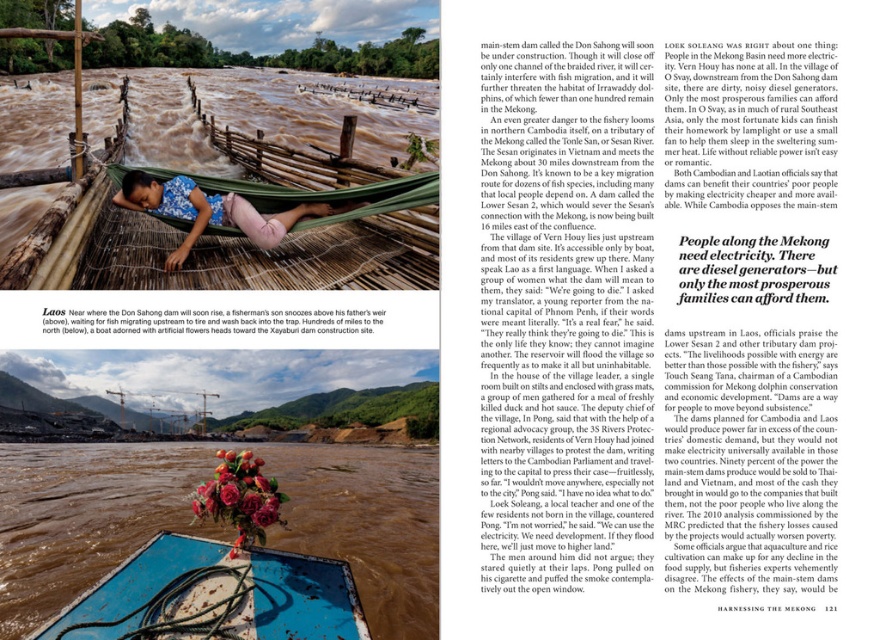
Question: Which of the following is the farthest from the observer?

Choices:
 (A) brown rubber boat at lower center
 (B) blue rubber boat at lower center

Answer: (A)

Question: Which of the following is the closest to the observer?

Choices:
 (A) floral fabric hammock at center
 (B) brown rubber boat at lower center
 (C) blue rubber boat at lower center

Answer: (C)

Question: Does brown rubber boat at lower center appear on the left side of blue rubber boat at lower center?

Choices:
 (A) yes
 (B) no

Answer: (A)

Question: Can you confirm if brown rubber boat at lower center is smaller than blue rubber boat at lower center?

Choices:
 (A) yes
 (B) no

Answer: (B)

Question: Can you confirm if blue rubber boat at lower center is thinner than floral fabric hammock at center?

Choices:
 (A) yes
 (B) no

Answer: (A)

Question: Based on their relative distances, which object is farther from the blue rubber boat at lower center?

Choices:
 (A) brown rubber boat at lower center
 (B) floral fabric hammock at center

Answer: (A)